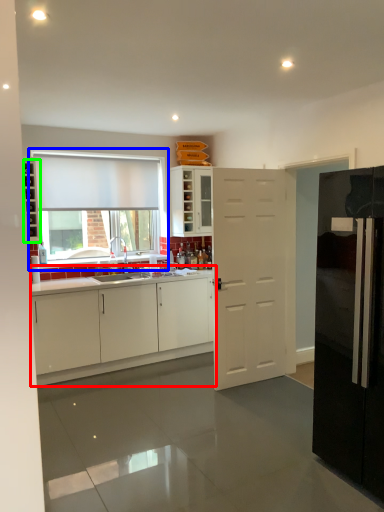
Question: Estimate the real-world distances between objects in this image. Which object is closer to cabinetry (highlighted by a red box), window (highlighted by a blue box) or shelf (highlighted by a green box)?

Choices:
 (A) window
 (B) shelf

Answer: (A)